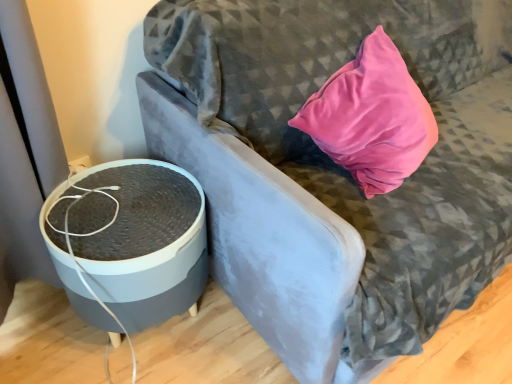
Question: Would you say matte gray round table at left contains matte gray speaker at left?

Choices:
 (A) no
 (B) yes

Answer: (A)

Question: From a real-world perspective, is matte gray round table at left below matte gray speaker at left?

Choices:
 (A) no
 (B) yes

Answer: (B)

Question: From the image's perspective, is matte gray round table at left on matte gray speaker at left?

Choices:
 (A) no
 (B) yes

Answer: (A)

Question: Does matte gray round table at left lie in front of matte gray speaker at left?

Choices:
 (A) no
 (B) yes

Answer: (A)

Question: Can you confirm if matte gray round table at left is shorter than matte gray speaker at left?

Choices:
 (A) no
 (B) yes

Answer: (B)

Question: From a real-world perspective, is matte gray round table at left positioned over matte gray speaker at left based on gravity?

Choices:
 (A) yes
 (B) no

Answer: (B)

Question: Is matte gray speaker at left to the right of matte gray round table at left from the viewer's perspective?

Choices:
 (A) yes
 (B) no

Answer: (A)

Question: From a real-world perspective, is matte gray speaker at left positioned over matte gray round table at left based on gravity?

Choices:
 (A) no
 (B) yes

Answer: (B)

Question: Is matte gray speaker at left directly adjacent to matte gray round table at left?

Choices:
 (A) yes
 (B) no

Answer: (B)

Question: Does matte gray speaker at left have a larger size compared to matte gray round table at left?

Choices:
 (A) no
 (B) yes

Answer: (B)

Question: Is matte gray speaker at left closer to the viewer compared to matte gray round table at left?

Choices:
 (A) no
 (B) yes

Answer: (B)

Question: Can you confirm if matte gray speaker at left is thinner than matte gray round table at left?

Choices:
 (A) no
 (B) yes

Answer: (A)

Question: Is point [175, 26] positioned closer to the camera than point [105, 286]?

Choices:
 (A) closer
 (B) farther

Answer: (B)